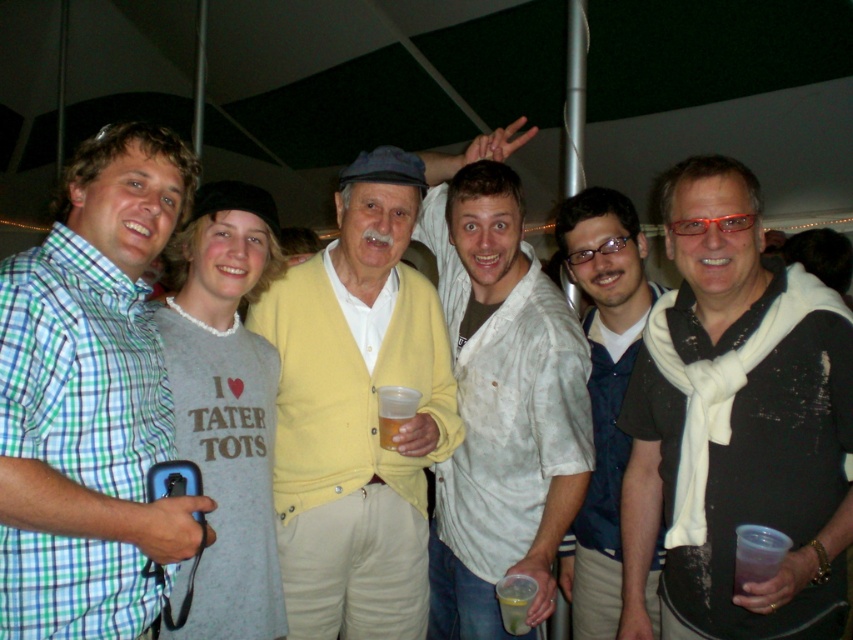
You are a photographer at an event and need to capture a clear shot of the yellow cardigan at center and the translucent plastic cup at center. Based on their heights, which object should you focus on first to ensure it doesn

The yellow cardigan at center is much taller than the translucent plastic cup at center, so you should focus on the yellow cardigan at center first to ensure it is in clear view before adjusting for the shorter cup.

You are at a social event and want to locate the black textured scarf at right. According to the coordinates provided, where should you look?

The black textured scarf at right is located at point (735, 424).

You are standing at the center of the tent and want to reach the point marked as point (10, 362). Which direction should you move relative to the other point point (299, 356)?

The point (10, 362) is in front of point (299, 356), so you should move forward towards it.